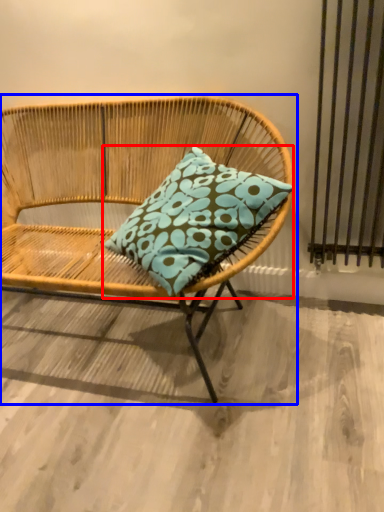
Question: Among these objects, which one is farthest to the camera, pillow (highlighted by a red box) or chair (highlighted by a blue box)?

Choices:
 (A) pillow
 (B) chair

Answer: (A)